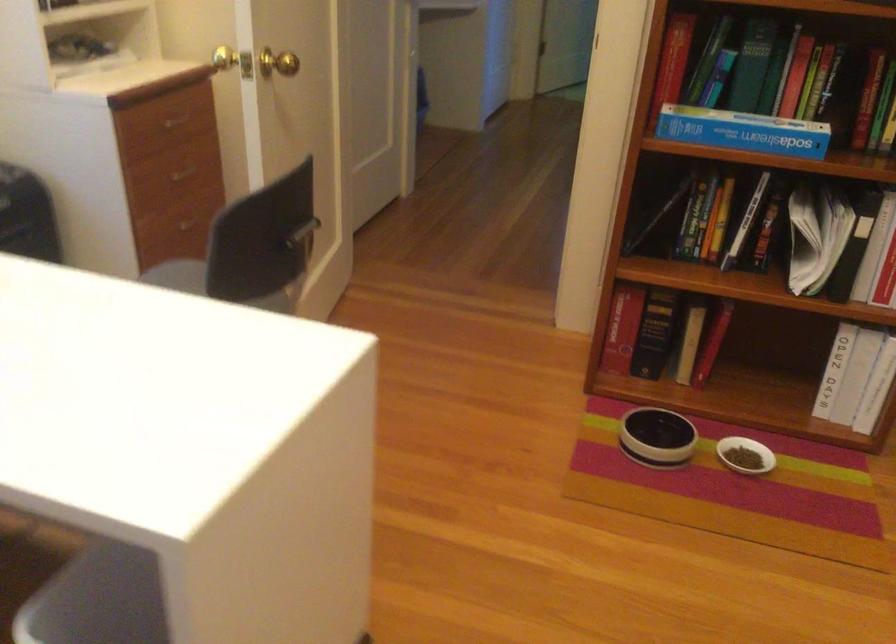
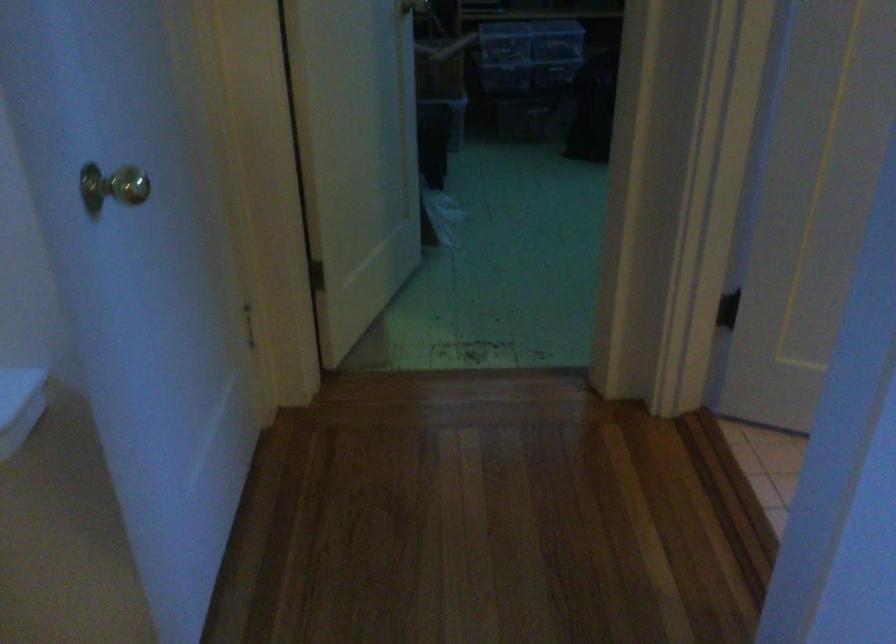
Question: What movement of the cameraman would produce the second image?

Choices:
 (A) Left
 (B) Right
 (C) Forward
 (D) Backward

Answer: (C)